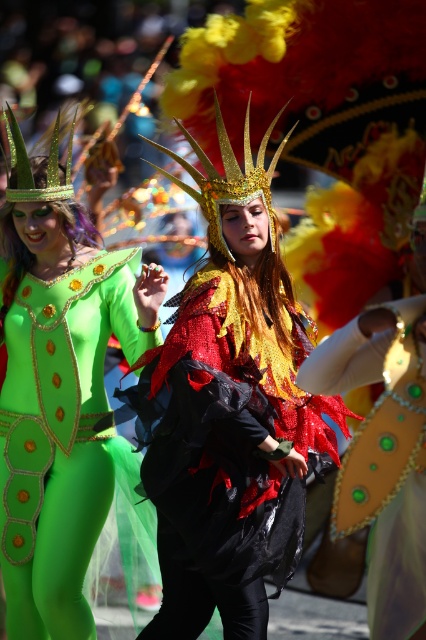
Question: Which point is farther from the camera taking this photo?

Choices:
 (A) (126, 346)
 (B) (322, 408)
 (C) (419, 356)

Answer: (A)

Question: Is green matte bodysuit at left smaller than shiny gold mask at center?

Choices:
 (A) no
 (B) yes

Answer: (A)

Question: Is green matte bodysuit at left to the left of shiny gold mask at center from the viewer's perspective?

Choices:
 (A) no
 (B) yes

Answer: (B)

Question: Among these objects, which one is farthest from the camera?

Choices:
 (A) shiny gold mask at center
 (B) green matte bodysuit at left

Answer: (B)

Question: Which object is the closest to the shiny gold mask at center?

Choices:
 (A) green matte bodysuit at left
 (B) shiny metallic costume at center

Answer: (B)

Question: Does shiny metallic costume at center have a larger size compared to green matte bodysuit at left?

Choices:
 (A) yes
 (B) no

Answer: (A)